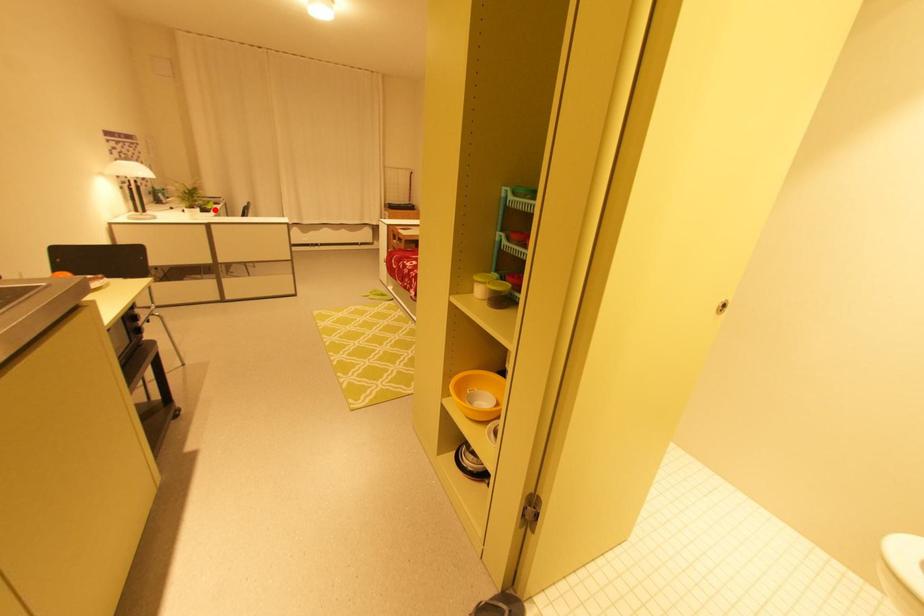
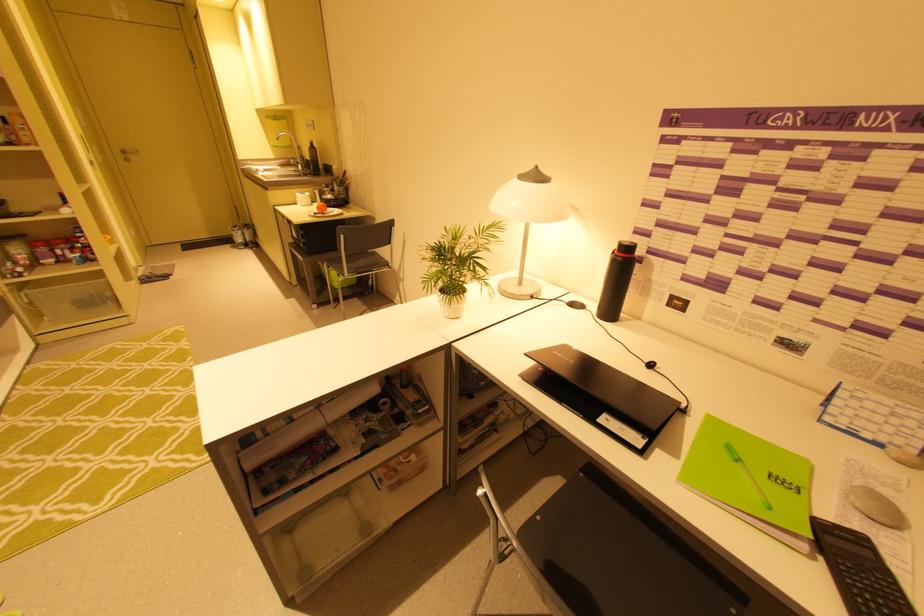
Find the pixel in the second image that matches the highlighted location in the first image.

(596, 419)